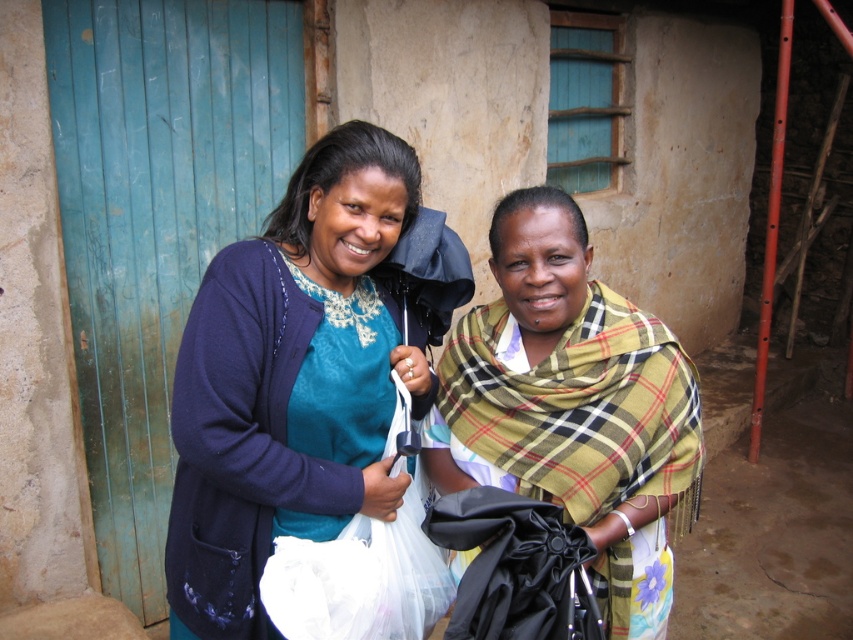
You are a fashion designer observing two items in the image. You need to decide which item is taller between the matte blue sweater at center and the plaid fabric shawl at center. Which one is taller?

The matte blue sweater at center is taller than the plaid fabric shawl at center.

You are standing in front of the rustic building and want to take a photo of the point at coordinates (525,442). If your camera has a focal length of 50mm and you are currently 3 meters away from the point, should you move closer or farther away to focus properly?

The point at coordinates (525,442) is 1.72 meters away from the camera. Since you are currently 3 meters away, you need to move closer to reach the minimum focusing distance required for clear capture.

You are a photographer standing 1.2 meters away from the plaid fabric shawl at center. Can you reach it without moving your feet?

The plaid fabric shawl at center is 1.50 meters away from the viewer. Since you are standing 1.2 meters away from it, you can reach it without moving your feet because the distance is within arm reach.